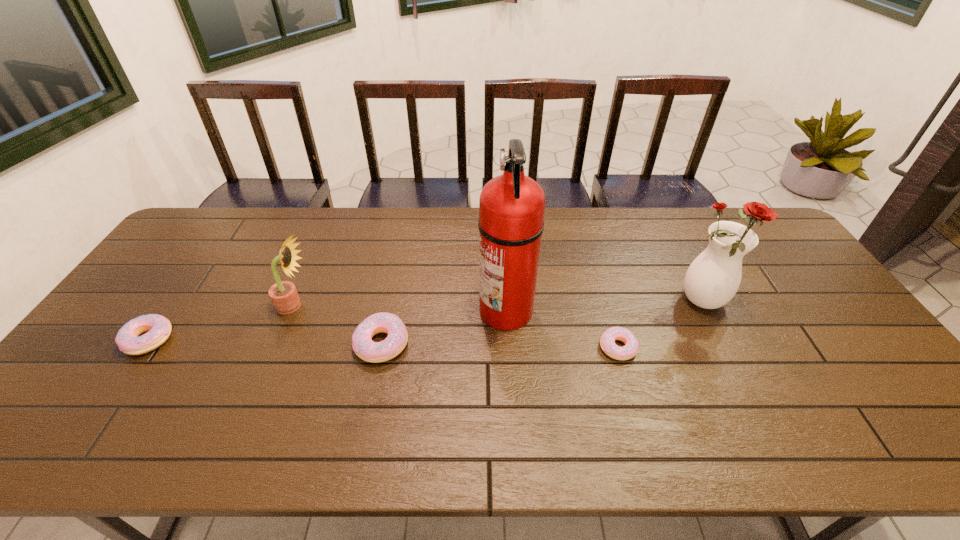
The width and height of the screenshot is (960, 540). Find the location of `the second object from left to right`. the second object from left to right is located at coordinates (283, 294).

What are the coordinates of `sunflower` in the screenshot? It's located at (283, 294).

Locate an element on the screen. The height and width of the screenshot is (540, 960). vacant space positioned on the right of the second tallest doughnut is located at coordinates (265, 340).

This screenshot has width=960, height=540. I want to click on free point located on the back of the fourth object from right to left, so click(x=397, y=267).

This screenshot has height=540, width=960. Find the location of `free space located on the left of the rightmost doughnut`. free space located on the left of the rightmost doughnut is located at coordinates (482, 347).

The width and height of the screenshot is (960, 540). Find the location of `vacant space located on the front of the rightmost object`. vacant space located on the front of the rightmost object is located at coordinates (735, 361).

Where is `vacant space located at the nozzle of the fire extinguisher`? The width and height of the screenshot is (960, 540). vacant space located at the nozzle of the fire extinguisher is located at coordinates (412, 309).

Where is `vacant space located at the nozzle of the fire extinguisher`? The height and width of the screenshot is (540, 960). vacant space located at the nozzle of the fire extinguisher is located at coordinates [367, 309].

Where is `vacant space located 0.370m at the nozzle of the fire extinguisher`? The image size is (960, 540). vacant space located 0.370m at the nozzle of the fire extinguisher is located at coordinates (349, 309).

Where is `vacant region located 0.300m on the face of the second object from left to right`? The height and width of the screenshot is (540, 960). vacant region located 0.300m on the face of the second object from left to right is located at coordinates (416, 306).